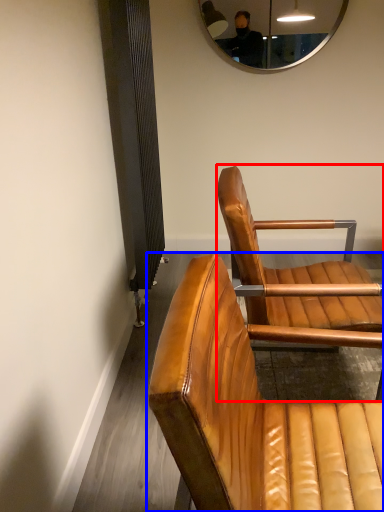
Question: Which point is closer to the camera, chair (highlighted by a red box) or chair (highlighted by a blue box)?

Choices:
 (A) chair
 (B) chair

Answer: (B)